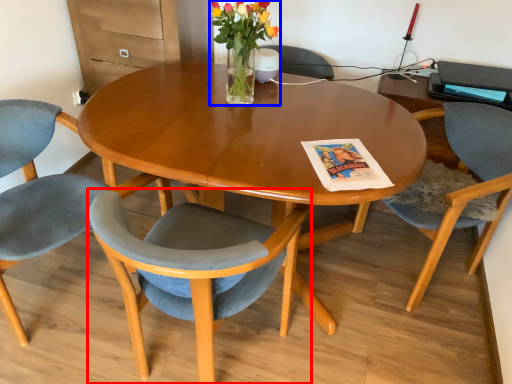
Question: Which object is closer to the camera taking this photo, chair (highlighted by a red box) or floral arrangement (highlighted by a blue box)?

Choices:
 (A) chair
 (B) floral arrangement

Answer: (A)